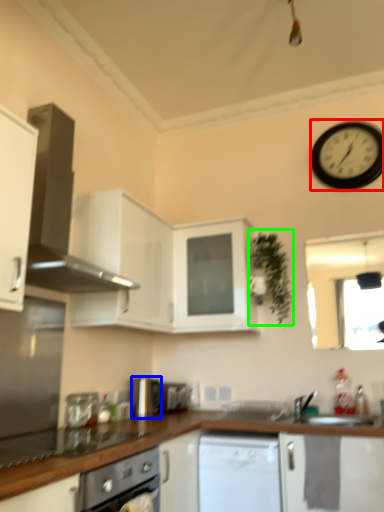
Question: Based on their relative distances, which object is farther from wall clock (highlighted by a red box)? Choose from appliance (highlighted by a blue box) and plant (highlighted by a green box).

Choices:
 (A) appliance
 (B) plant

Answer: (A)